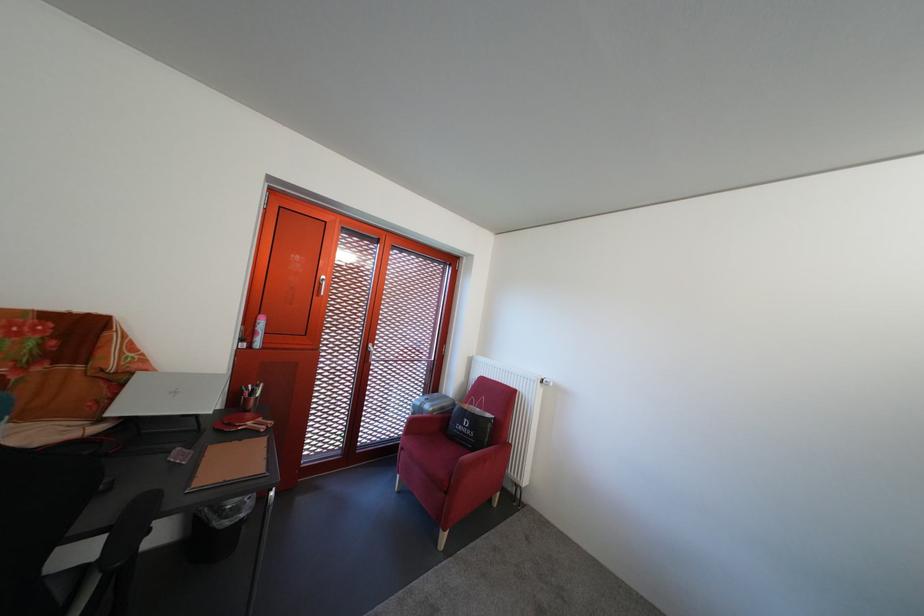
Identify the location of black paper bag. (469, 428).